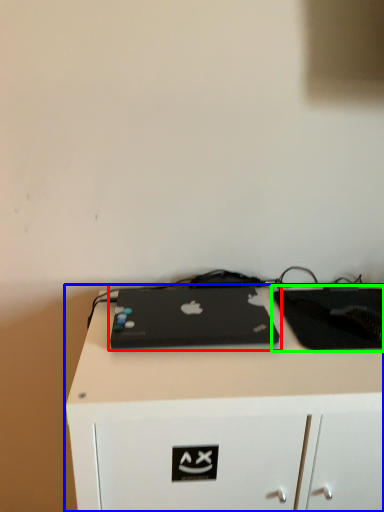
Question: Estimate the real-world distances between objects in this image. Which object is farther from laptop (highlighted by a red box), desk (highlighted by a blue box) or tablet computer (highlighted by a green box)?

Choices:
 (A) desk
 (B) tablet computer

Answer: (B)